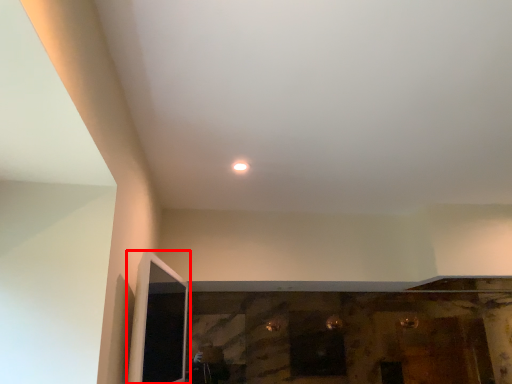
Question: In this image, where is screen door (annotated by the red box) located relative to light?

Choices:
 (A) right
 (B) left

Answer: (B)